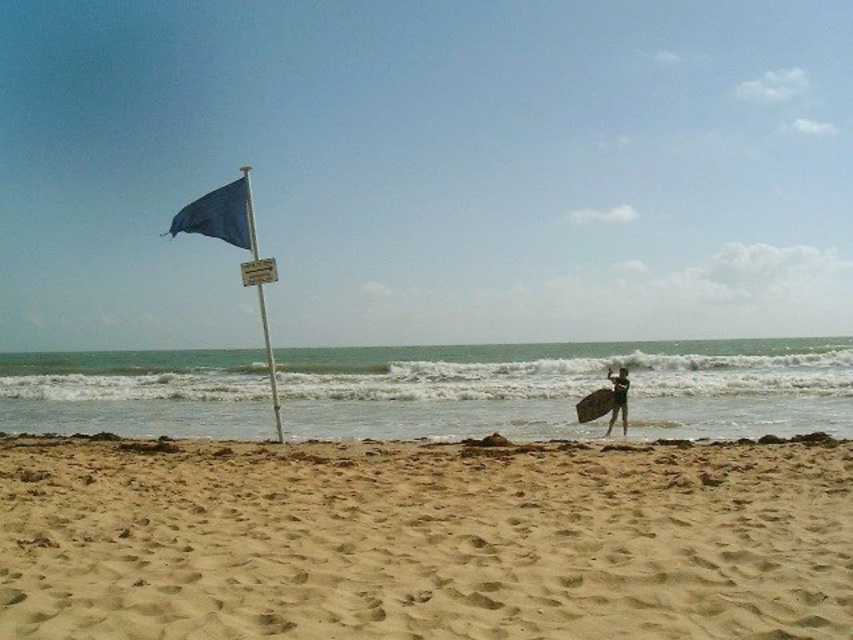
Does point (573, 570) come farther from viewer compared to point (604, 400)?

No, it is in front of (604, 400).

Can you confirm if fine-grained sand at lower center is positioned below brown wooden surfboard at right?

Incorrect, fine-grained sand at lower center is not positioned below brown wooden surfboard at right.

Is point (112, 470) positioned behind point (579, 420)?

That is False.

I want to click on fine-grained sand at lower center, so click(x=424, y=541).

Looking at this image, is fine-grained sand at lower center behind black matte surfboard at right?

No.

Who is more forward, (x=685, y=588) or (x=624, y=422)?

Point (x=685, y=588)

Locate an element on the screen. This screenshot has width=853, height=640. fine-grained sand at lower center is located at coordinates (424, 541).

Which is more to the left, fine-grained sand at lower center or blue fabric flagpole at left?

blue fabric flagpole at left is more to the left.

Who is higher up, fine-grained sand at lower center or blue fabric flagpole at left?

Positioned higher is blue fabric flagpole at left.

Between point (495, 449) and point (277, 426), which one is positioned in front?

Point (495, 449) is in front.

Locate an element on the screen. The width and height of the screenshot is (853, 640). fine-grained sand at lower center is located at coordinates (424, 541).